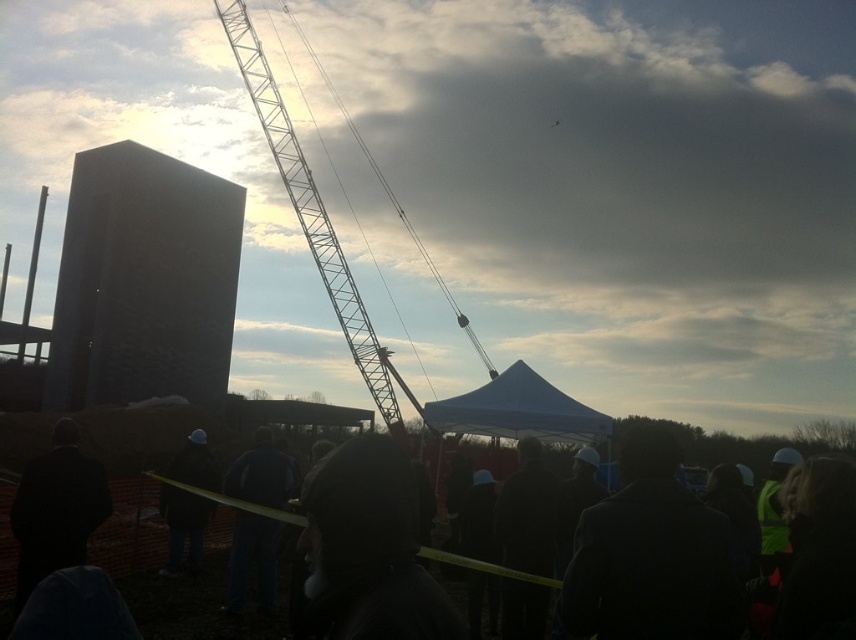
Question: Which point is closer to the camera?

Choices:
 (A) (182, 598)
 (B) (82, 525)

Answer: (A)

Question: Is black fabric crowd at lower center thinner than dark fabric jacket at center?

Choices:
 (A) no
 (B) yes

Answer: (A)

Question: Among these objects, which one is nearest to the camera?

Choices:
 (A) white metallic crane at upper center
 (B) dark fabric jacket at center
 (C) black fabric crowd at lower center

Answer: (A)

Question: Can you confirm if white metallic crane at upper center is wider than dark fabric jacket at center?

Choices:
 (A) yes
 (B) no

Answer: (A)

Question: Is black fabric crowd at lower center thinner than dark fabric jacket at center?

Choices:
 (A) yes
 (B) no

Answer: (B)

Question: Which point is farther to the camera?

Choices:
 (A) dark fabric jacket at center
 (B) white metallic crane at upper center
 (C) black fabric crowd at lower center
 (D) dark suit at lower left

Answer: (A)